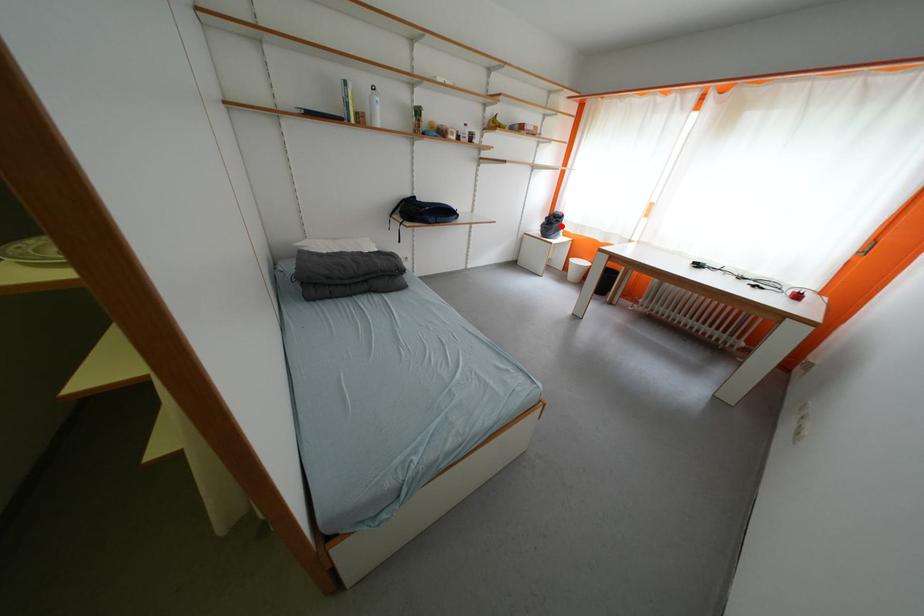
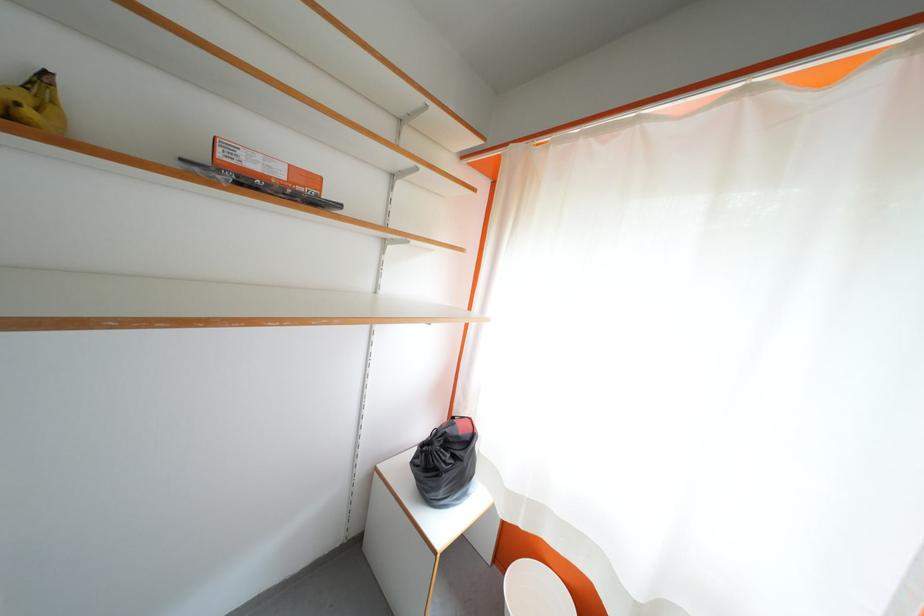
Question: I am providing you with two images of the same scene from different viewpoints. Given a red point in image1, look at the same physical point in image2. Is it:

Choices:
 (A) Closer to the viewpoint
 (B) Farther from the viewpoint

Answer: (B)